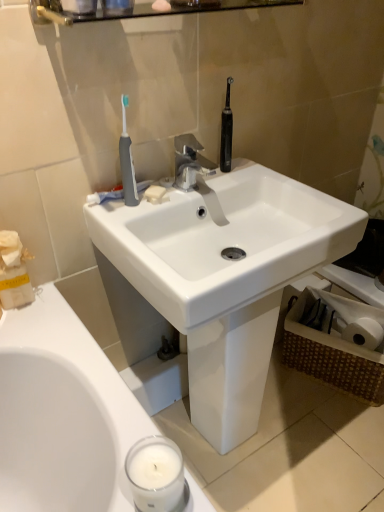
The image size is (384, 512). Describe the element at coordinates (154, 192) in the screenshot. I see `white matte soap at sink center` at that location.

The height and width of the screenshot is (512, 384). What are the coordinates of `silver metallic faucet at center` in the screenshot? It's located at (190, 161).

In order to face silver metallic faucet at center, should I rotate leftwards or rightwards?

Turn right approximately 0.474 degrees to face it.

Find the location of a particular element. The height and width of the screenshot is (512, 384). glossy glass shelf at upper center is located at coordinates click(x=135, y=8).

Describe the element at coordinates (225, 276) in the screenshot. Image resolution: width=384 pixels, height=512 pixels. I see `white glossy sink at center` at that location.

The width and height of the screenshot is (384, 512). Describe the element at coordinates (13, 271) in the screenshot. I see `white paper tissue at upper left` at that location.

Locate an element on the screen. white matte soap at sink center is located at coordinates (154, 192).

From a real-world perspective, is silver metallic faucet at center physically below white paper tissue at upper left?

Incorrect, from a real-world perspective, silver metallic faucet at center is higher than white paper tissue at upper left.

Does point (211, 165) come closer to viewer compared to point (12, 287)?

No, (211, 165) is further to viewer.

In the scene shown: Is silver metallic faucet at center to the left of white paper tissue at upper left from the viewer's perspective?

No, silver metallic faucet at center is not to the left of white paper tissue at upper left.

From the image's perspective, is silver metallic faucet at center located above or below glossy glass shelf at upper center?

Based on their image positions, silver metallic faucet at center is located beneath glossy glass shelf at upper center.

Can you confirm if silver metallic faucet at center is wider than glossy glass shelf at upper center?

Correct, the width of silver metallic faucet at center exceeds that of glossy glass shelf at upper center.

Can glossy glass shelf at upper center be found inside silver metallic faucet at center?

No, glossy glass shelf at upper center is not surrounded by silver metallic faucet at center.

Where is `tap in front of the white matte soap at sink center`? Image resolution: width=384 pixels, height=512 pixels. tap in front of the white matte soap at sink center is located at coordinates (190, 161).

Is white matte soap at sink center positioned beyond the bounds of silver metallic faucet at center?

white matte soap at sink center is positioned outside silver metallic faucet at center.

Does white matte soap at sink center appear on the left side of silver metallic faucet at center?

Indeed, white matte soap at sink center is positioned on the left side of silver metallic faucet at center.

Is point (16, 285) in front of point (162, 192)?

Yes, it is in front of point (162, 192).

Considering the sizes of objects white paper tissue at upper left and white matte soap at sink center in the image provided, who is thinner, white paper tissue at upper left or white matte soap at sink center?

white matte soap at sink center is thinner.

Between white paper tissue at upper left and white matte soap at sink center, which one appears on the right side from the viewer's perspective?

From the viewer's perspective, white matte soap at sink center appears more on the right side.

From the image's perspective, is white paper tissue at upper left positioned above or below white matte soap at sink center?

Clearly, from the image's perspective, white paper tissue at upper left is below white matte soap at sink center.

Is gray rubber toothbrush at upper left to the left of silver metallic faucet at center from the viewer's perspective?

Correct, you'll find gray rubber toothbrush at upper left to the left of silver metallic faucet at center.

Are gray rubber toothbrush at upper left and silver metallic faucet at center far apart?

Actually, gray rubber toothbrush at upper left and silver metallic faucet at center are a little close together.

This screenshot has width=384, height=512. I want to click on toothbrush lying in front of the silver metallic faucet at center, so click(127, 161).

Would you say gray rubber toothbrush at upper left contains silver metallic faucet at center?

That's incorrect, silver metallic faucet at center is not inside gray rubber toothbrush at upper left.

How different are the orientations of white matte soap at sink center and white paper tissue at upper left in degrees?

The angular difference between white matte soap at sink center and white paper tissue at upper left is 40.5 degrees.

Which of these two, white matte soap at sink center or white paper tissue at upper left, stands taller?

white paper tissue at upper left is taller.

Who is more distant, white matte soap at sink center or white paper tissue at upper left?

white matte soap at sink center is further away from the camera.

Looking at this image, is white paper tissue at upper left at the back of white matte soap at sink center?

That's not correct — white matte soap at sink center is not looking away from white paper tissue at upper left.

Is white paper tissue at upper left surrounding silver metallic faucet at center?

Definitely not — silver metallic faucet at center is not inside white paper tissue at upper left.

Is white paper tissue at upper left aimed at silver metallic faucet at center?

No, white paper tissue at upper left is not facing towards silver metallic faucet at center.

Considering the sizes of white paper tissue at upper left and silver metallic faucet at center in the image, is white paper tissue at upper left wider or thinner than silver metallic faucet at center?

white paper tissue at upper left is thinner than silver metallic faucet at center.

From a real-world perspective, between white paper tissue at upper left and silver metallic faucet at center, who is vertically higher?

In real-world perspective, silver metallic faucet at center is above.

Where is `tap lying on the right of white paper tissue at upper left`? tap lying on the right of white paper tissue at upper left is located at coordinates (190, 161).

Find the location of a particular element. Image resolution: width=384 pixels, height=512 pixels. balustrade on the left of silver metallic faucet at center is located at coordinates (135, 8).

Based on the photo, estimate the real-world distances between objects in this image. Which object is closer to glossy glass shelf at upper center, white matte soap at sink center or white glossy sink at center?

Based on the image, white matte soap at sink center appears to be nearer to glossy glass shelf at upper center.

From the image, which object appears to be nearer to white glossy sink at center, glossy glass shelf at upper center or white paper tissue at upper left?

white paper tissue at upper left.

When comparing their distances from glossy glass shelf at upper center, does silver metallic faucet at center or white paper tissue at upper left seem closer?

silver metallic faucet at center.

From the image, which object appears to be farther from white matte soap at sink center, white glossy sink at center or glossy glass shelf at upper center?

glossy glass shelf at upper center is further to white matte soap at sink center.

Estimate the real-world distances between objects in this image. Which object is closer to white matte soap at sink center, glossy glass shelf at upper center or white glossy sink at center?

Among the two, white glossy sink at center is located nearer to white matte soap at sink center.

Looking at the image, which one is located further to silver metallic faucet at center, white glossy sink at center or white matte soap at sink center?

white glossy sink at center.

From the image, which object appears to be farther from glossy glass shelf at upper center, white paper tissue at upper left or gray rubber toothbrush at upper left?

Based on the image, white paper tissue at upper left appears to be further to glossy glass shelf at upper center.

Considering their positions, is white paper tissue at upper left positioned closer to glossy glass shelf at upper center than white glossy sink at center?

The object closer to glossy glass shelf at upper center is white paper tissue at upper left.

Locate an element on the screen. The width and height of the screenshot is (384, 512). toothbrush between glossy glass shelf at upper center and white paper tissue at upper left in the up-down direction is located at coordinates (127, 161).

Image resolution: width=384 pixels, height=512 pixels. I want to click on toothbrush between white paper tissue at upper left and white glossy sink at center from left to right, so click(x=127, y=161).

Where is `soap between white paper tissue at upper left and white glossy sink at center in the horizontal direction`? This screenshot has height=512, width=384. soap between white paper tissue at upper left and white glossy sink at center in the horizontal direction is located at coordinates tap(154, 192).

Where is `toothbrush that lies between glossy glass shelf at upper center and white matte soap at sink center from top to bottom`? The image size is (384, 512). toothbrush that lies between glossy glass shelf at upper center and white matte soap at sink center from top to bottom is located at coordinates tap(127, 161).